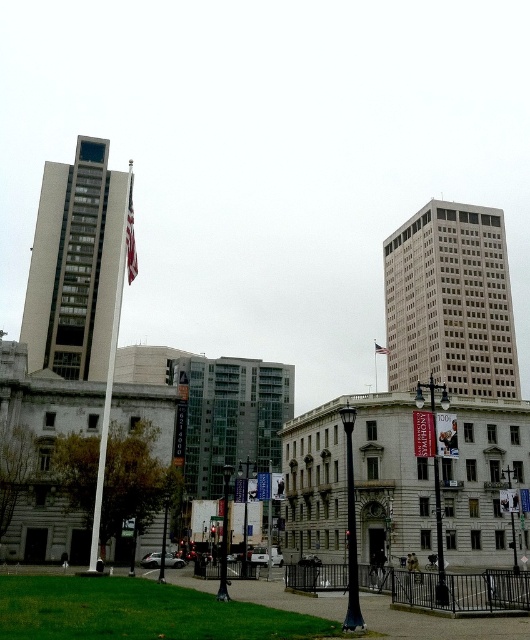
Does polished silver flag pole at center come behind american flag at center?

No, polished silver flag pole at center is in front of american flag at center.

Who is higher up, polished silver flag pole at center or american flag at center?

polished silver flag pole at center

Who is more forward, (128, 260) or (376, 353)?

Point (128, 260) is in front.

This screenshot has height=640, width=530. I want to click on polished silver flag pole at center, so (x=113, y=358).

Does point (490, 342) come behind point (72, 342)?

That is True.

Is white glass building at upper right positioned at the back of gray concrete building at center?

Yes, it is behind gray concrete building at center.

Image resolution: width=530 pixels, height=640 pixels. Describe the element at coordinates (450, 301) in the screenshot. I see `white glass building at upper right` at that location.

I want to click on white glass building at upper right, so [450, 301].

Locate an element on the screen. The height and width of the screenshot is (640, 530). white glass building at upper right is located at coordinates (450, 301).

Which is above, white glass building at upper right or white fabric flag at center?

Positioned higher is white fabric flag at center.

Is point (483, 266) behind point (125, 252)?

Yes, point (483, 266) is farther from viewer.

Locate an element on the screen. The image size is (530, 640). white glass building at upper right is located at coordinates (450, 301).